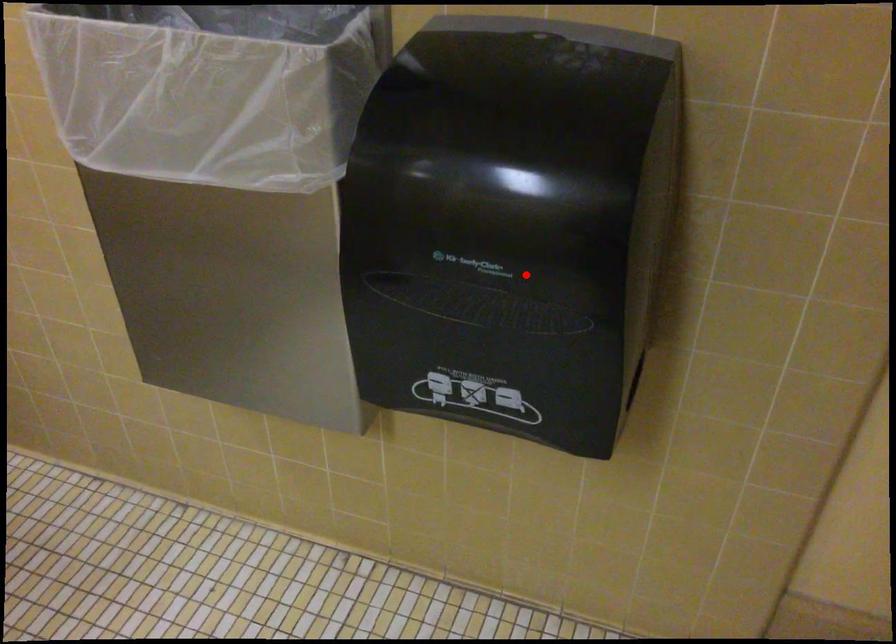
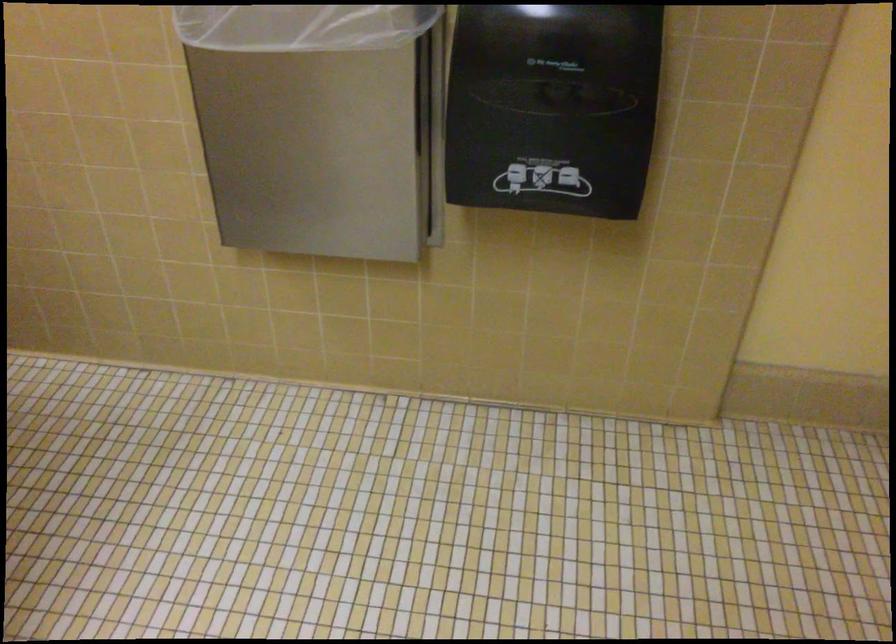
The point at the highlighted location is marked in the first image. Where is the corresponding point in the second image?

(552, 107)